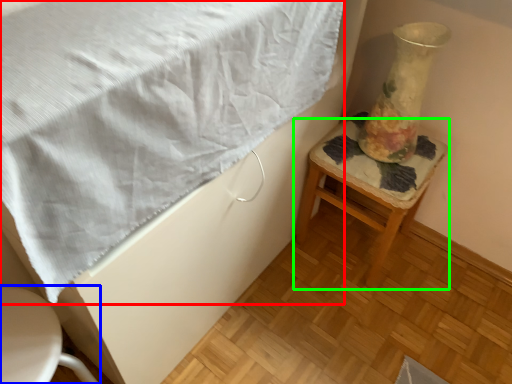
Question: Which object is positioned closest to blanket (highlighted by a red box)? Select from furniture (highlighted by a blue box) and stool (highlighted by a green box).

Choices:
 (A) furniture
 (B) stool

Answer: (A)